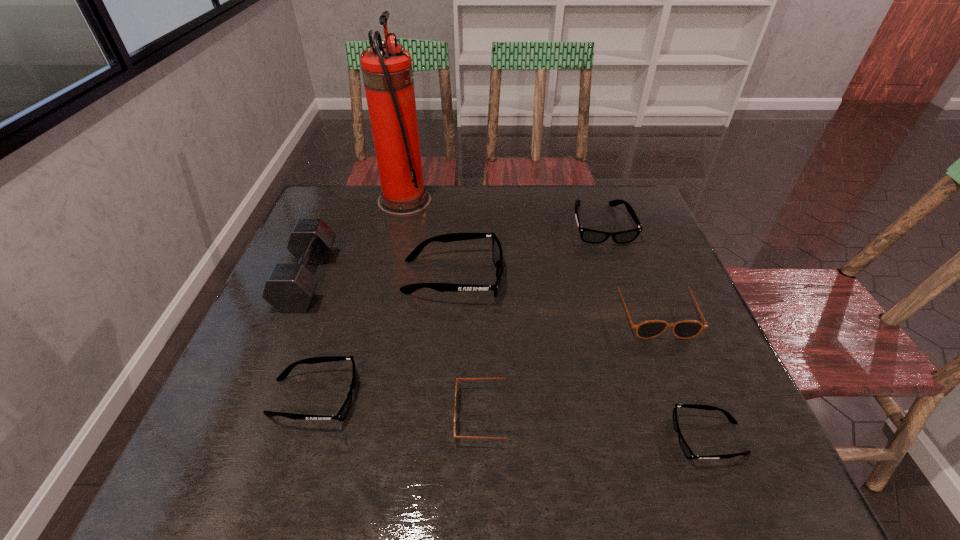
Identify the location of the leftmost black sunglasses. This screenshot has height=540, width=960. (342, 413).

This screenshot has height=540, width=960. I want to click on the third biggest black sunglasses, so click(342, 413).

The height and width of the screenshot is (540, 960). Find the location of `the shortest sunglasses`. the shortest sunglasses is located at coordinates (689, 454).

Identify the location of the smallest black sunglasses. Image resolution: width=960 pixels, height=540 pixels. (689, 454).

At what (x,y) coordinates should I click in order to perform the action: click on vacant space situated 0.100m at the discharge end of the fire extinguisher. Please return your answer as a coordinate pair (x, y). Looking at the image, I should click on tap(464, 201).

Where is `vacant area situated on the back of the second tallest object`? This screenshot has width=960, height=540. vacant area situated on the back of the second tallest object is located at coordinates (333, 218).

Where is `vacant space located 0.350m on the front-facing side of the biggest black sunglasses`? This screenshot has width=960, height=540. vacant space located 0.350m on the front-facing side of the biggest black sunglasses is located at coordinates (640, 276).

Where is `blank space located 0.280m on the front-facing side of the farther brown sunglasses`? blank space located 0.280m on the front-facing side of the farther brown sunglasses is located at coordinates (714, 465).

Identify the location of vacant area situated 0.270m on the front-facing side of the farthest black sunglasses. (634, 321).

This screenshot has height=540, width=960. Find the location of `vacant region located 0.350m on the front-facing side of the nearer brown sunglasses`. vacant region located 0.350m on the front-facing side of the nearer brown sunglasses is located at coordinates (271, 415).